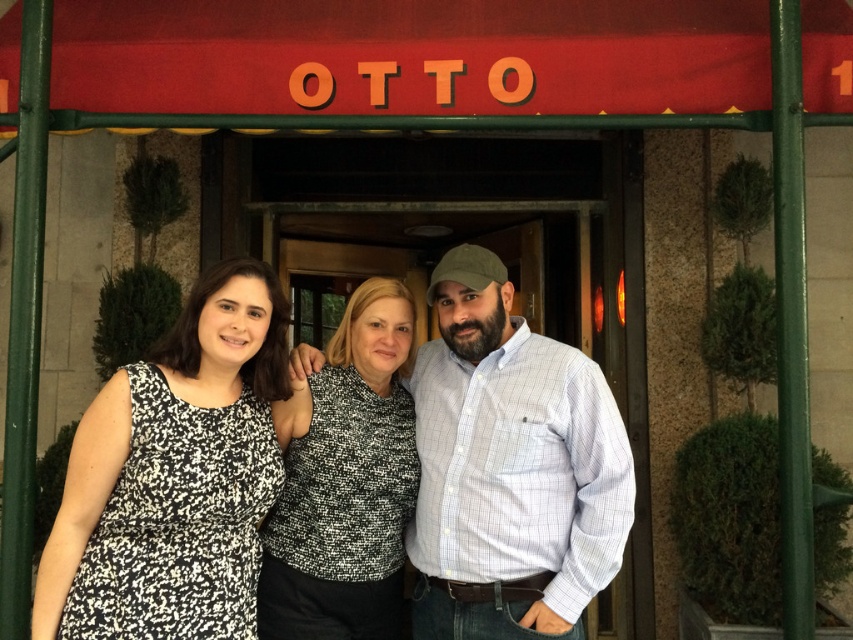
Is point (463, 628) positioned in front of point (341, 481)?

That is True.

Is white checkered shirt at center smaller than speckled fabric blouse at center?

No, white checkered shirt at center is not smaller than speckled fabric blouse at center.

I want to click on white checkered shirt at center, so click(509, 468).

Is speckled fabric blouse at center above printed fabric shirt at center?

Incorrect, speckled fabric blouse at center is not positioned above printed fabric shirt at center.

Is point (363, 541) in front of point (509, 330)?

Yes, it is.

Find the location of `speckled fabric blouse at center`. speckled fabric blouse at center is located at coordinates (345, 483).

The height and width of the screenshot is (640, 853). What do you see at coordinates (173, 476) in the screenshot? I see `black printed dress at left` at bounding box center [173, 476].

Who is lower down, black printed dress at left or printed fabric shirt at center?

Positioned lower is black printed dress at left.

Who is more forward, [76,500] or [593,481]?

Point [76,500] is in front.

Identify the location of black printed dress at left. This screenshot has width=853, height=640. (173, 476).